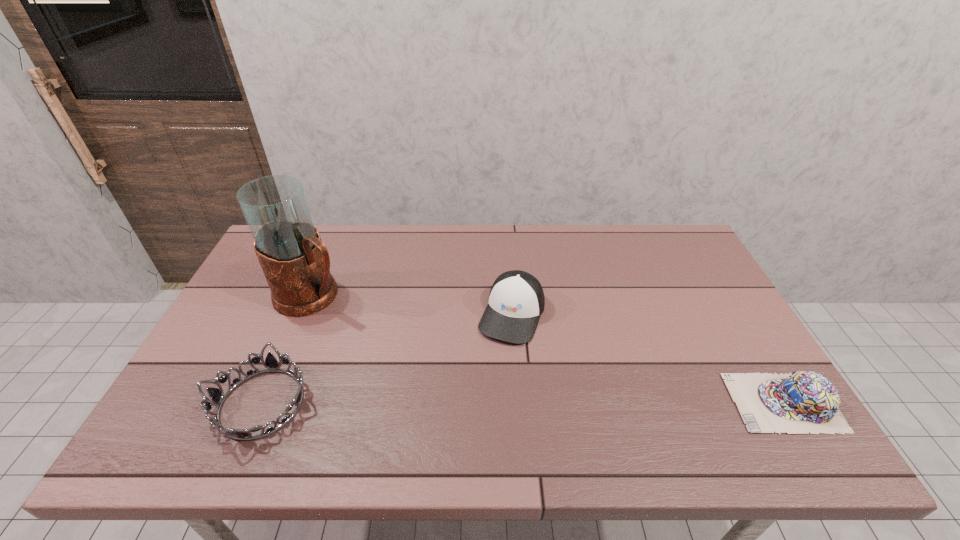
You are a GUI agent. You are given a task and a screenshot of the screen. Output one action in this format:
    pyautogui.click(x=<x>, y=<y>)
    Task: Click on the free space on the desktop that is between the tiara and the right cap and is positioned on the front panel of the farther cap
    
    Given the screenshot: What is the action you would take?
    pyautogui.click(x=475, y=403)

The height and width of the screenshot is (540, 960). What are the coordinates of `vacant space on the desktop that is between the tiara and the nearer cap and is positioned with the handle on the side of the tallest object` in the screenshot? It's located at (504, 403).